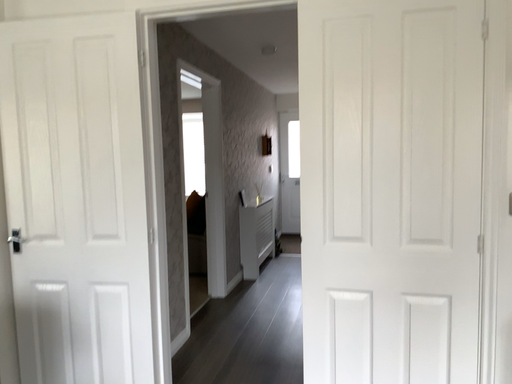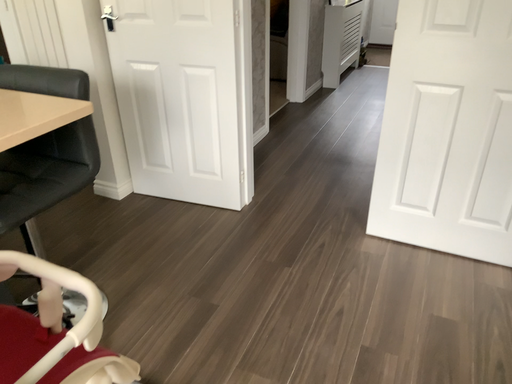
Question: How did the camera likely rotate when shooting the video?

Choices:
 (A) rotated downward
 (B) rotated upward

Answer: (A)